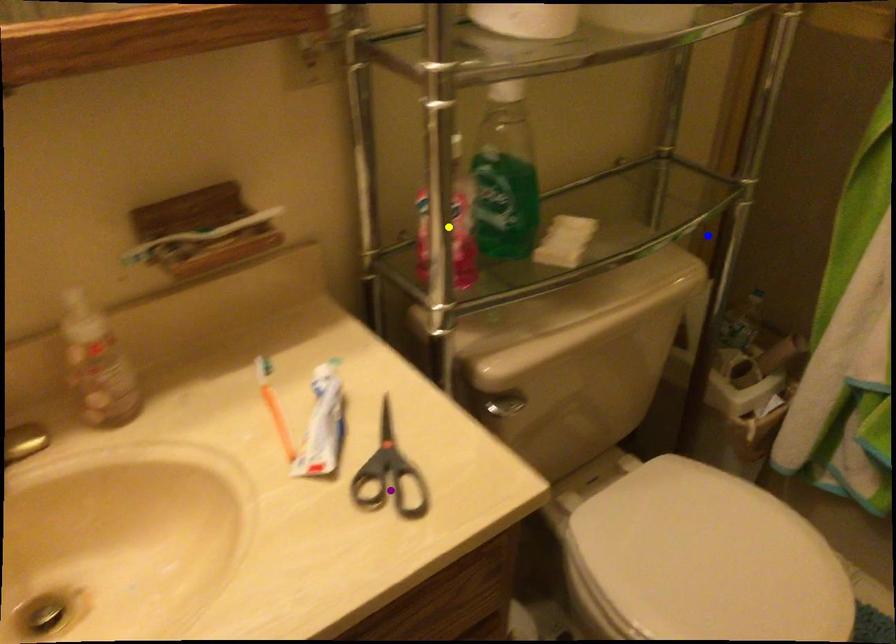
Order these from nearest to farthest:
purple point
yellow point
blue point

blue point → yellow point → purple point